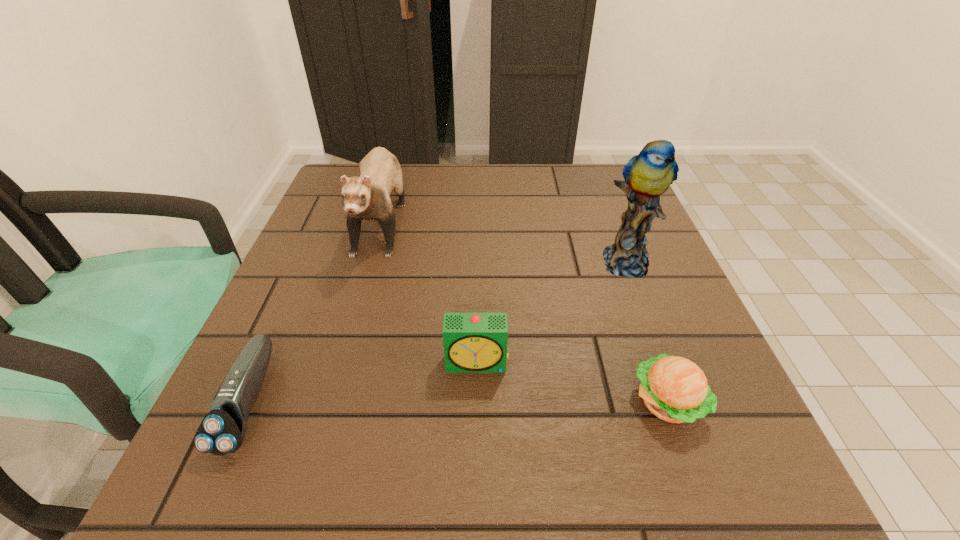
The width and height of the screenshot is (960, 540). What are the coordinates of `free spot that satisfies the following two spatial constraints: 1. on the front-facing side of the fourth tallest object; 2. on the right side of the third object from left to right` in the screenshot? It's located at (477, 402).